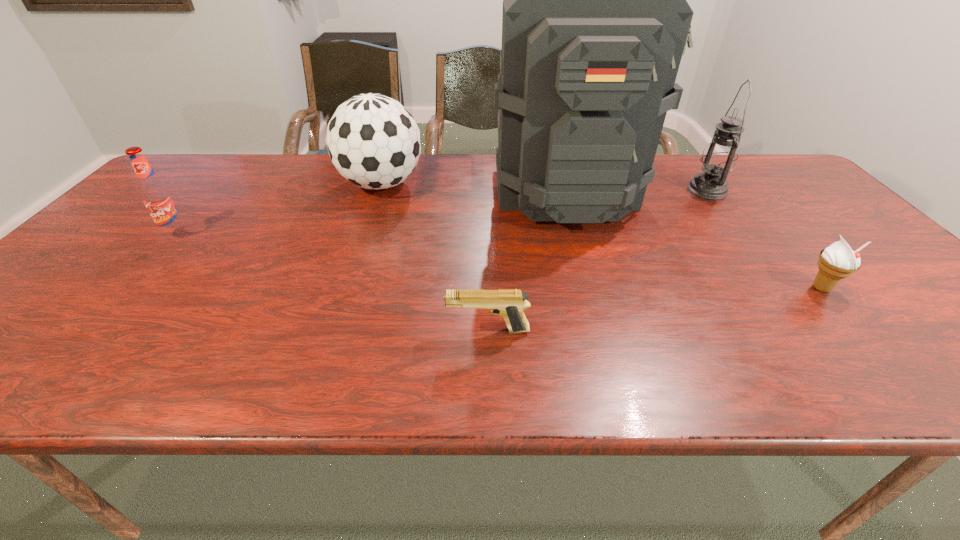
The image size is (960, 540). In order to click on object that is the third closest to the soccer ball in this screenshot , I will do `click(508, 303)`.

I want to click on vacant position in the image that satisfies the following two spatial constraints: 1. on the front compartment of the backpack; 2. at the barrel of the shortest object, so click(x=605, y=330).

What are the coordinates of `vacant space that satisfies the following two spatial constraints: 1. on the front side of the oil lamp; 2. on the right side of the fifth farthest object` in the screenshot? It's located at (782, 288).

The image size is (960, 540). I want to click on vacant space that satisfies the following two spatial constraints: 1. on the back side of the root beer; 2. on the left side of the oil lamp, so click(x=217, y=190).